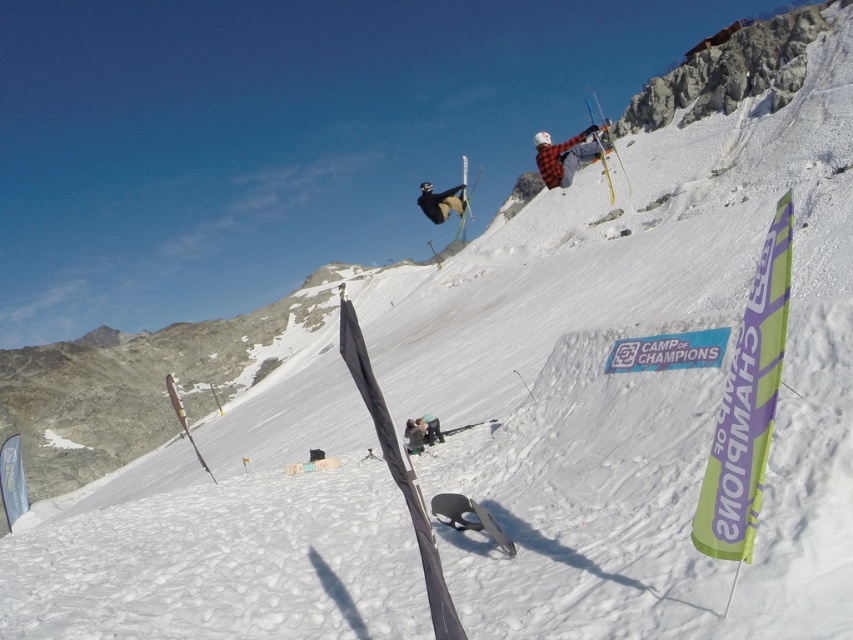
Is point (422, 440) behind point (463, 202)?

No.

Locate an element on the screen. This screenshot has height=640, width=853. matte black snowboard at center is located at coordinates (415, 436).

Which is in front, point (412, 420) or point (466, 202)?

Point (412, 420) is more forward.

Locate an element on the screen. The height and width of the screenshot is (640, 853). matte black snowboard at center is located at coordinates (415, 436).

Which is above, checkered fabric skier at upper center or matte black ski at center?

matte black ski at center is higher up.

Can you confirm if checkered fabric skier at upper center is wider than matte black ski at center?

In fact, checkered fabric skier at upper center might be narrower than matte black ski at center.

Is point (566, 164) closer to viewer compared to point (463, 211)?

Yes, it is in front of point (463, 211).

Locate an element on the screen. This screenshot has height=640, width=853. checkered fabric skier at upper center is located at coordinates (564, 156).

Is black matte snowboarder at upper center further to the viewer compared to green fabric jacket at center?

Yes.

Is black matte snowboarder at upper center to the right of green fabric jacket at center from the viewer's perspective?

Indeed, black matte snowboarder at upper center is positioned on the right side of green fabric jacket at center.

This screenshot has height=640, width=853. I want to click on black matte snowboarder at upper center, so click(440, 202).

Locate an element on the screen. black matte snowboarder at upper center is located at coordinates (x=440, y=202).